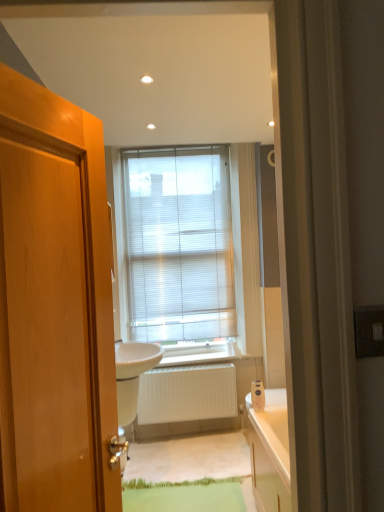
Question: Is white/translucent blinds at center wider than white glossy sink at center?

Choices:
 (A) yes
 (B) no

Answer: (B)

Question: Are white/translucent blinds at center and white glossy sink at center making contact?

Choices:
 (A) no
 (B) yes

Answer: (A)

Question: Is white/translucent blinds at center at the right side of white glossy sink at center?

Choices:
 (A) no
 (B) yes

Answer: (B)

Question: Considering the relative positions of white/translucent blinds at center and white glossy sink at center in the image provided, is white/translucent blinds at center to the left of white glossy sink at center from the viewer's perspective?

Choices:
 (A) no
 (B) yes

Answer: (A)

Question: Is the depth of white/translucent blinds at center less than that of white glossy sink at center?

Choices:
 (A) no
 (B) yes

Answer: (A)

Question: From the image's perspective, is white matte radiator at center located above or below white/translucent blinds at center?

Choices:
 (A) above
 (B) below

Answer: (B)

Question: Considering the positions of white matte radiator at center and white/translucent blinds at center in the image, is white matte radiator at center wider or thinner than white/translucent blinds at center?

Choices:
 (A) wide
 (B) thin

Answer: (A)

Question: Do you think white matte radiator at center is within white/translucent blinds at center, or outside of it?

Choices:
 (A) outside
 (B) inside

Answer: (A)

Question: Considering the positions of white matte radiator at center and white/translucent blinds at center in the image, is white matte radiator at center bigger or smaller than white/translucent blinds at center?

Choices:
 (A) big
 (B) small

Answer: (B)

Question: Is point (114, 347) positioned closer to the camera than point (163, 246)?

Choices:
 (A) farther
 (B) closer

Answer: (B)

Question: Would you say white glossy sink at center is inside or outside white/translucent blinds at center?

Choices:
 (A) outside
 (B) inside

Answer: (A)

Question: From the image's perspective, is white glossy sink at center located above or below white/translucent blinds at center?

Choices:
 (A) below
 (B) above

Answer: (A)

Question: Looking at the image, does white glossy sink at center seem bigger or smaller compared to white/translucent blinds at center?

Choices:
 (A) big
 (B) small

Answer: (A)

Question: From the image's perspective, is white glossy sink at center positioned above or below silver metallic door handle at lower left?

Choices:
 (A) above
 (B) below

Answer: (A)

Question: Is white glossy sink at center spatially inside silver metallic door handle at lower left, or outside of it?

Choices:
 (A) outside
 (B) inside

Answer: (A)